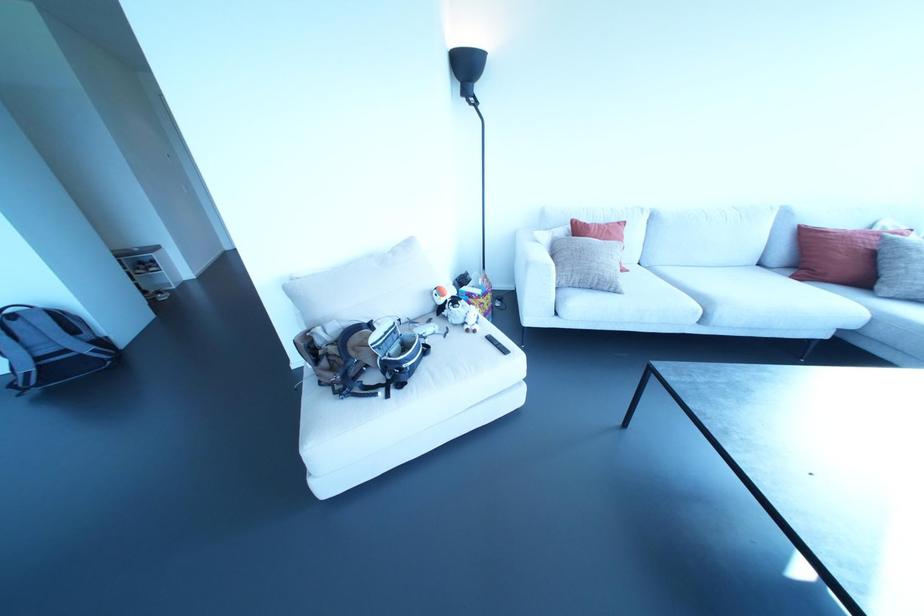
The width and height of the screenshot is (924, 616). Identify the location of small white drone. (460, 314).